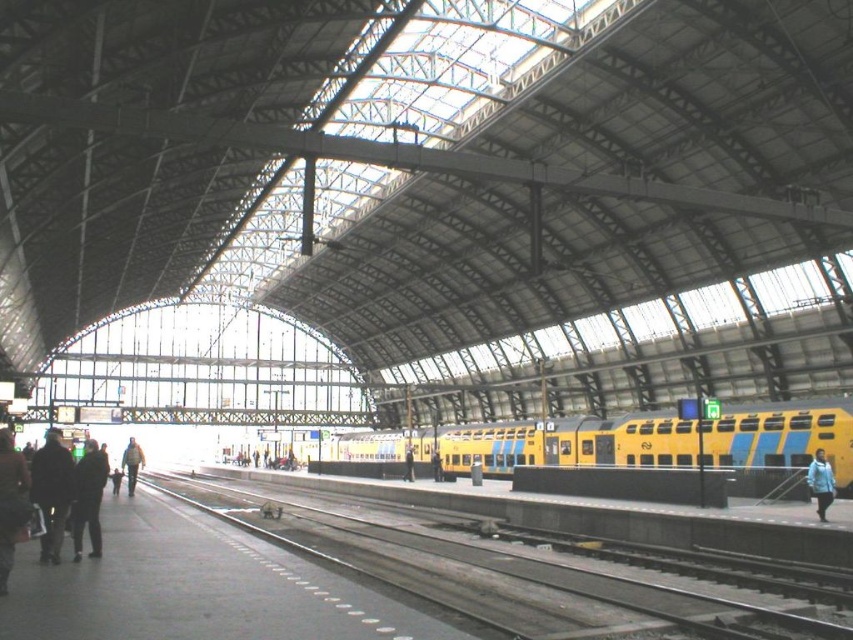
Question: Is dark gray jacket at left to the right of blue fabric jacket at lower right from the viewer's perspective?

Choices:
 (A) yes
 (B) no

Answer: (B)

Question: Is blue fabric jacket at lower right to the left of black leather jacket at center from the viewer's perspective?

Choices:
 (A) yes
 (B) no

Answer: (B)

Question: Among these objects, which one is farthest from the camera?

Choices:
 (A) dark gray jacket at left
 (B) light brown leather jacket at center
 (C) dark brown leather jacket at lower left
 (D) dark brown leather jacket at left

Answer: (B)

Question: Is yellow matte train at center closer to the viewer compared to dark gray jacket at left?

Choices:
 (A) no
 (B) yes

Answer: (A)

Question: Which of the following is the closest to the observer?

Choices:
 (A) yellow matte train at center
 (B) smooth concrete track at lower left
 (C) dark brown leather jacket at lower left

Answer: (C)

Question: Which point is closer to the camera?

Choices:
 (A) light brown leather jacket at center
 (B) dark gray jacket at left
 (C) blue fabric jacket at lower right
 (D) yellow matte train at center

Answer: (B)